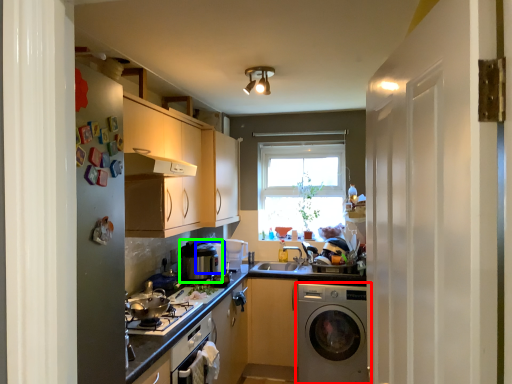
Question: Estimate the real-world distances between objects in this image. Which object is closer to washing machine (highlighted by a red box), appliance (highlighted by a blue box) or appliance (highlighted by a green box)?

Choices:
 (A) appliance
 (B) appliance

Answer: (A)